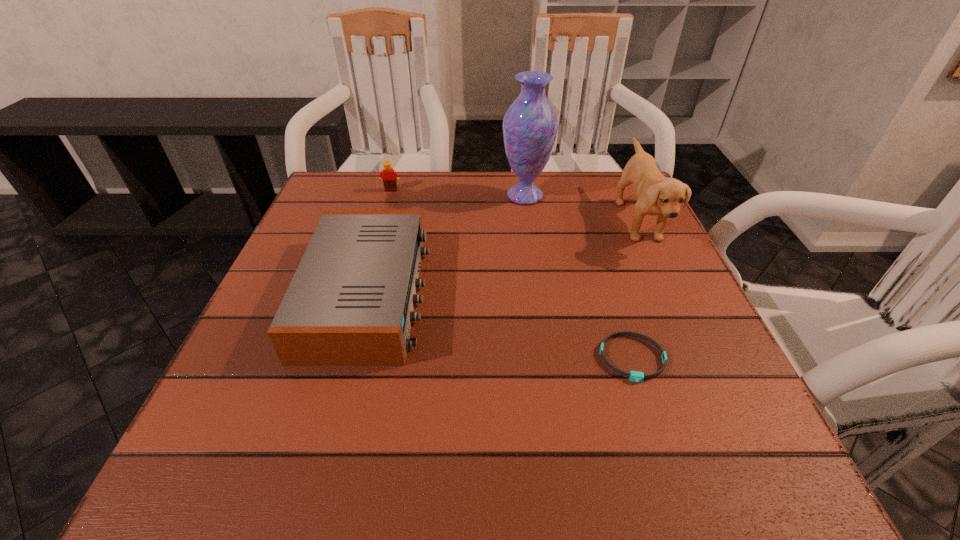
Find the location of a particular element. The image size is (960, 540). the third object from right to left is located at coordinates pos(530,125).

You are a GUI agent. You are given a task and a screenshot of the screen. Output one action in this format:
    pyautogui.click(x=<x>, y=<y>)
    Task: Click on the vase
    This screenshot has height=540, width=960.
    Given the screenshot: What is the action you would take?
    pyautogui.click(x=530, y=125)

Where is `the fourth shortest object`? the fourth shortest object is located at coordinates (656, 194).

This screenshot has height=540, width=960. I want to click on puppy, so click(656, 194).

Where is `Lego`? The image size is (960, 540). Lego is located at coordinates (390, 176).

This screenshot has width=960, height=540. I want to click on radio receiver, so click(x=350, y=302).

Identify the location of the shortest object. The height and width of the screenshot is (540, 960). (635, 376).

Find the location of a particular element. This screenshot has height=540, width=960. wristband is located at coordinates (635, 376).

Where is `vacant area situated on the front of the third object from right to left`? This screenshot has width=960, height=540. vacant area situated on the front of the third object from right to left is located at coordinates (533, 251).

Where is `vacant space located 0.350m on the left side of the rightmost object`? This screenshot has width=960, height=540. vacant space located 0.350m on the left side of the rightmost object is located at coordinates (471, 221).